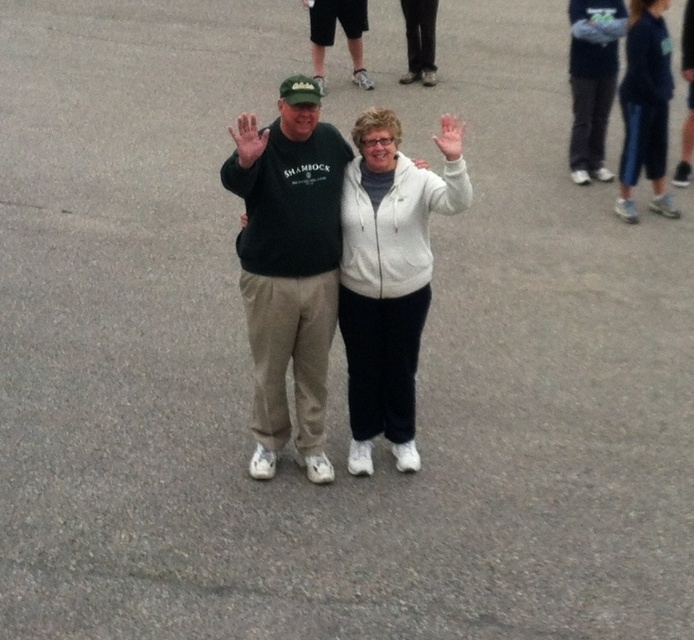
Question: Can you confirm if dark green sweatshirt at center is positioned below white fleece jacket at center?

Choices:
 (A) no
 (B) yes

Answer: (A)

Question: Observing the image, what is the correct spatial positioning of white fleece jacket at center in reference to blue fleece sweatshirt at right?

Choices:
 (A) left
 (B) right

Answer: (A)

Question: Which of the following is the farthest from the observer?

Choices:
 (A) (641, 168)
 (B) (382, 428)
 (C) (285, 273)

Answer: (A)

Question: Considering the real-world distances, which object is farthest from the dark green sweatshirt at center?

Choices:
 (A) white fleece jacket at center
 (B) blue fleece sweatshirt at right

Answer: (B)

Question: Which point is farther to the camera?

Choices:
 (A) (382, 179)
 (B) (652, 204)

Answer: (B)

Question: Is dark green sweatshirt at center in front of blue fleece sweatshirt at right?

Choices:
 (A) no
 (B) yes

Answer: (B)